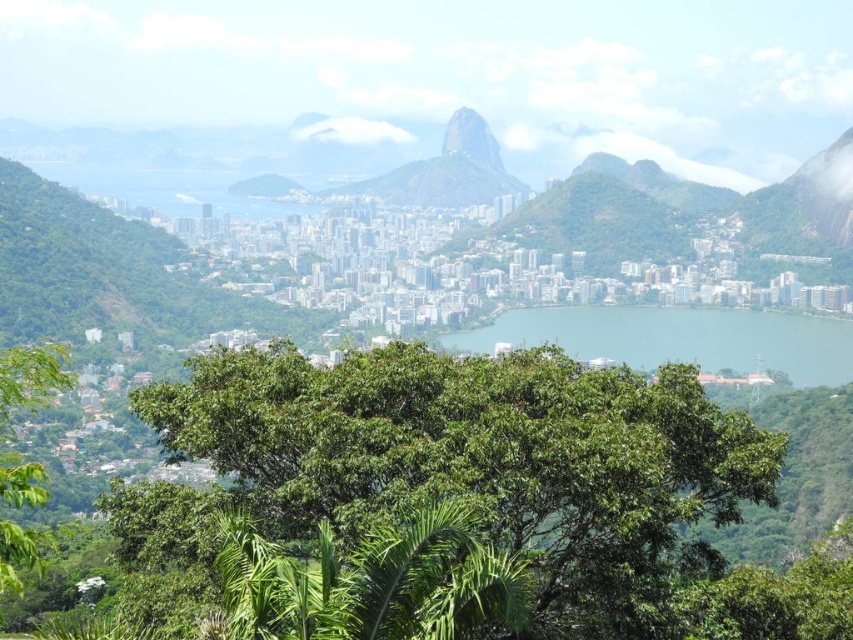
Is green leafy tree at center to the right of green textured mountain at center from the viewer's perspective?

Yes, green leafy tree at center is to the right of green textured mountain at center.

Does point (550, 408) lie behind point (339, 195)?

No.

Where is `green leafy tree at center`? The height and width of the screenshot is (640, 853). green leafy tree at center is located at coordinates (485, 461).

Does green leafy tree at center have a smaller size compared to blue water at center?

Incorrect, green leafy tree at center is not smaller in size than blue water at center.

Is point (326, 458) positioned behind point (718, 349)?

No, (326, 458) is closer to viewer.

Locate an element on the screen. This screenshot has height=640, width=853. green leafy tree at center is located at coordinates (485, 461).

Which is above, green textured mountain at center or green rock formation at center?

green rock formation at center

Is green textured mountain at center to the right of green rock formation at center from the viewer's perspective?

No, green textured mountain at center is not to the right of green rock formation at center.

Where is `green textured mountain at center`? Image resolution: width=853 pixels, height=640 pixels. green textured mountain at center is located at coordinates (445, 172).

The height and width of the screenshot is (640, 853). Find the location of `green textured mountain at center`. green textured mountain at center is located at coordinates (445, 172).